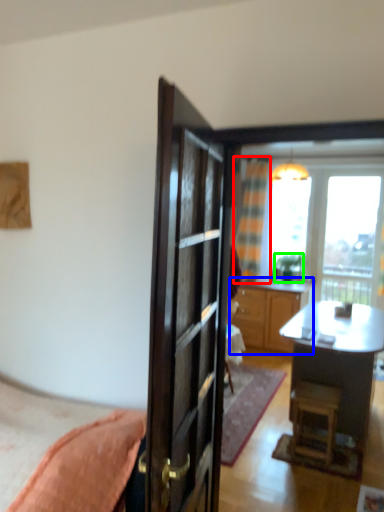
Question: Considering the real-world distances, which object is farthest from curtain (highlighted by a red box)? cabinetry (highlighted by a blue box) or houseplant (highlighted by a green box)?

Choices:
 (A) cabinetry
 (B) houseplant

Answer: (A)